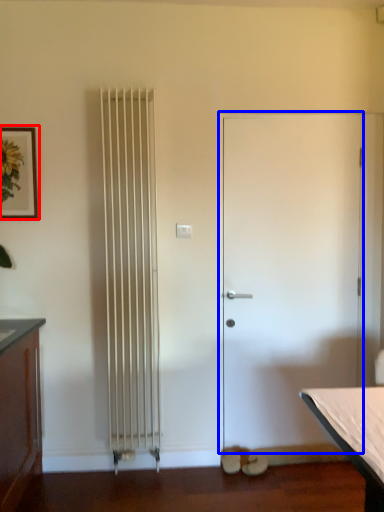
Question: Which of the following is the farthest to the observer, picture frame (highlighted by a red box) or door (highlighted by a blue box)?

Choices:
 (A) picture frame
 (B) door

Answer: (B)